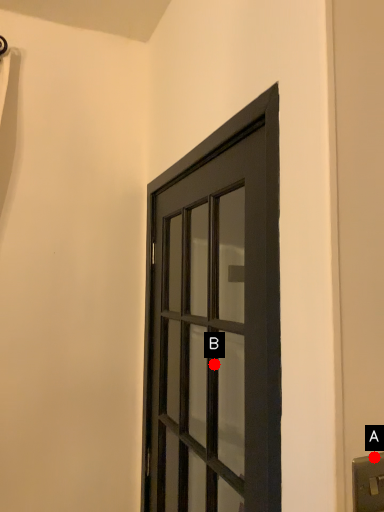
Question: Two points are circled on the image, labeled by A and B beside each circle. Which point is closer to the camera taking this photo?

Choices:
 (A) A is closer
 (B) B is closer

Answer: (A)